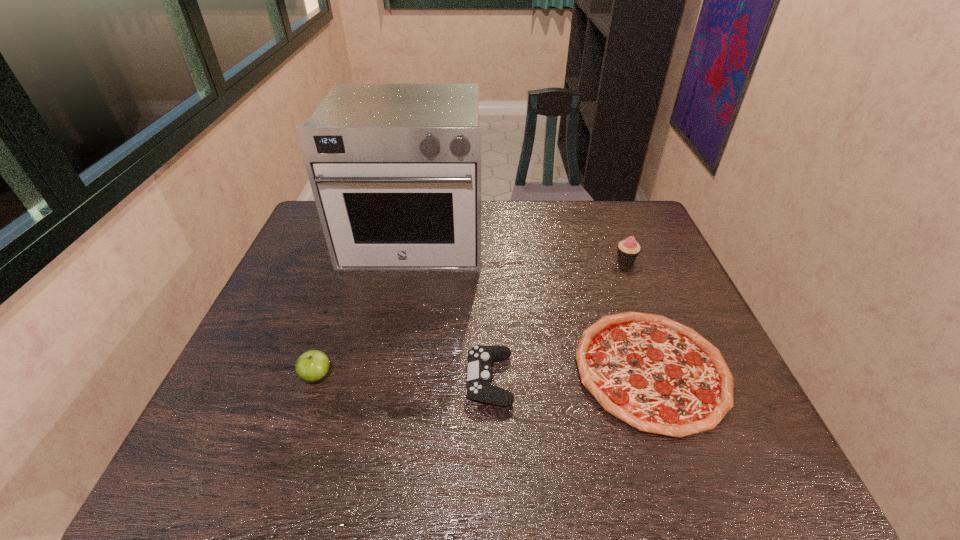
Find the location of a particular element. The height and width of the screenshot is (540, 960). vacant space at the right edge of the desktop is located at coordinates (643, 283).

Where is `vacant space at the far left corner of the desktop`? vacant space at the far left corner of the desktop is located at coordinates (309, 237).

In the image, there is a desktop. Find the location of `free space at the far right corner`. free space at the far right corner is located at coordinates (628, 210).

The image size is (960, 540). I want to click on vacant space that is in between the shortest object and the fourth tallest object, so click(570, 374).

What are the coordinates of `free space between the cupcake and the apple` in the screenshot? It's located at (471, 318).

Locate an element on the screen. This screenshot has width=960, height=540. free space between the apple and the cupcake is located at coordinates (471, 318).

This screenshot has height=540, width=960. I want to click on vacant space that's between the apple and the cupcake, so click(471, 318).

Identify the location of vacant space in between the apple and the tallest object. The image size is (960, 540). (365, 307).

Image resolution: width=960 pixels, height=540 pixels. Find the location of `free space that is in between the control and the shortest object`. free space that is in between the control and the shortest object is located at coordinates (570, 374).

Locate an element on the screen. free area in between the cupcake and the toaster oven is located at coordinates (520, 248).